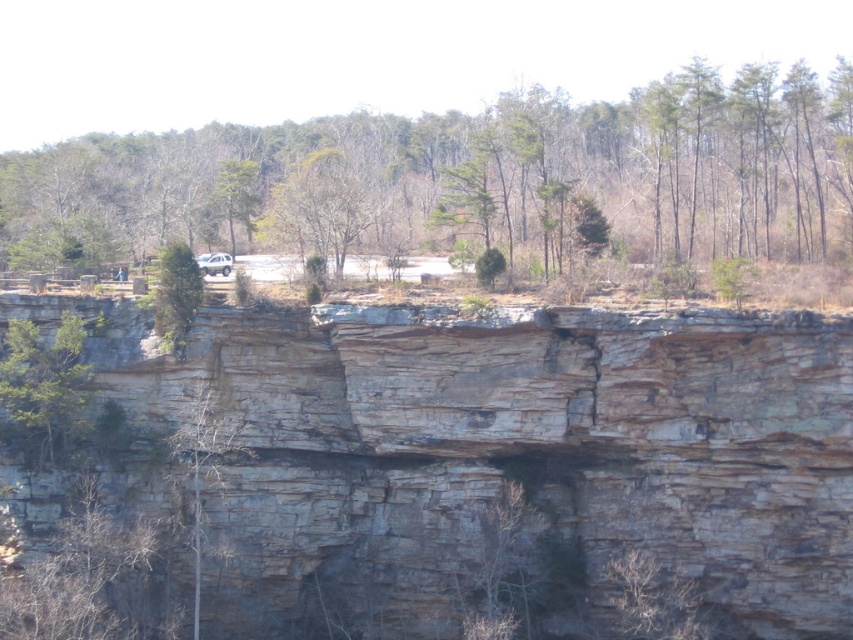
You are a hiker planning to take a photo of the gray rock cliff at center and the green leafy tree at upper center. Which object should you focus on first if you want to capture both in a single frame without moving the camera?

You should focus on the gray rock cliff at center first because it is positioned under the green leafy tree at upper center, so adjusting focus to the cliff ensures the tree remains in the frame above it.

You are a hiker standing at the base of the gray rock cliff at center and want to reach the green leafy tree at left. Which path would require less elevation gain? Explain your reasoning based on the scene description.

The path to the green leafy tree at left would require less elevation gain because the gray rock cliff at center is taller than the tree, indicating the tree is located at a lower elevation.

You are a hiker standing at the base of the cliff. You see a green leafy tree at upper center and a green leafy tree at left. Which tree is higher up in the image?

The green leafy tree at upper center is higher up in the image because it is located above the green leafy tree at left.